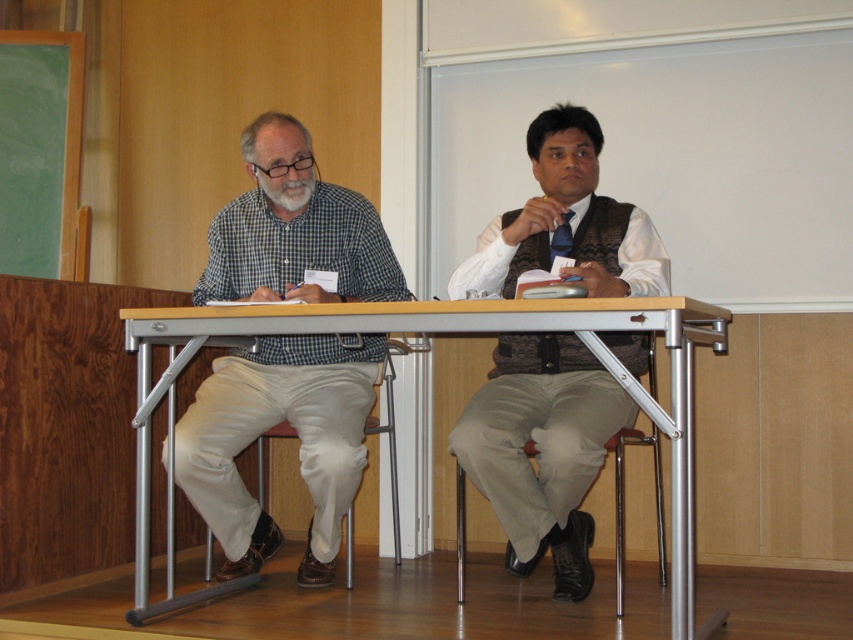
Question: Does checkered fabric shirt at left appear on the right side of metallic silver table at center?

Choices:
 (A) yes
 (B) no

Answer: (B)

Question: Is matte brown vest at center wider than metallic silver table at center?

Choices:
 (A) yes
 (B) no

Answer: (B)

Question: Which object is positioned farthest from the metallic silver table at center?

Choices:
 (A) checkered fabric shirt at left
 (B) matte brown vest at center

Answer: (A)

Question: Which is nearer to the checkered fabric shirt at left?

Choices:
 (A) metallic silver table at center
 (B) matte brown vest at center

Answer: (A)

Question: Does matte brown vest at center lie in front of metallic silver table at center?

Choices:
 (A) no
 (B) yes

Answer: (A)

Question: Which of these objects is positioned farthest from the metallic silver table at center?

Choices:
 (A) checkered fabric shirt at left
 (B) matte brown vest at center

Answer: (A)